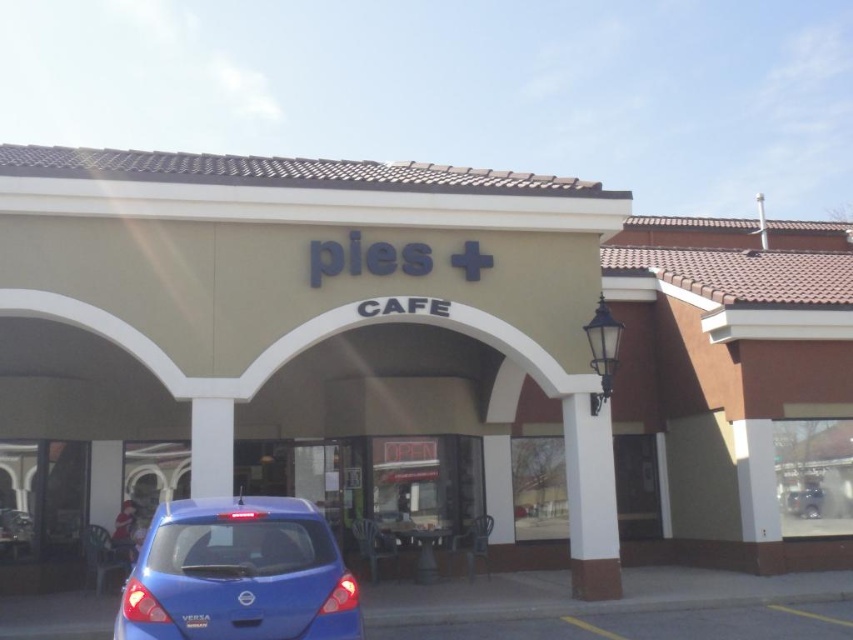
You are a customer arriving at the cafe and want to enter through the main entrance. The blue glossy hatchback at lower left is blocking your path. Can you walk around it to reach the beige stucco cafe at center?

The blue glossy hatchback at lower left is behind the beige stucco cafe at center, so you can walk around it to reach the beige stucco cafe at center.

Consider the image. You are standing at the entrance of the PIES CAFE and want to walk to the blue car parked outside. There are two points marked on the ground as reference points. The first point is at coordinate point (457, 496) and the second point is at coordinate point (129, 598). Which point should you walk towards first to reach the blue car?

You should walk towards point (129, 598) first because point (457, 496) is behind it, so the closer point to the blue car is point (129, 598).